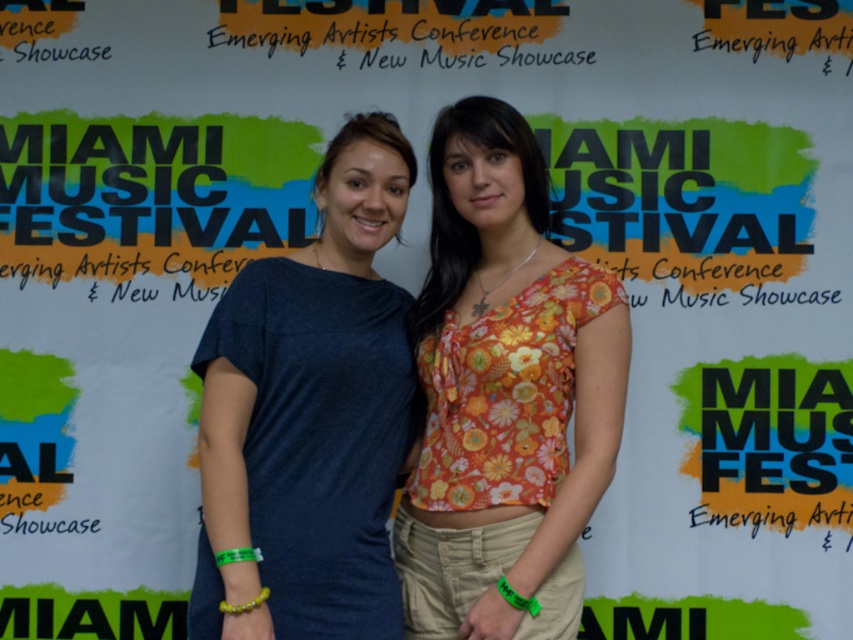
Is floral fabric top at center shorter than matte blue t-shirt at center?

Incorrect, floral fabric top at center's height does not fall short of matte blue t-shirt at center's.

Find the location of `floral fabric top at center`. floral fabric top at center is located at coordinates 503,394.

Is point (480, 529) positioned behind point (337, 360)?

No, (480, 529) is in front of (337, 360).

Identify the location of floral fabric top at center. This screenshot has width=853, height=640. point(503,394).